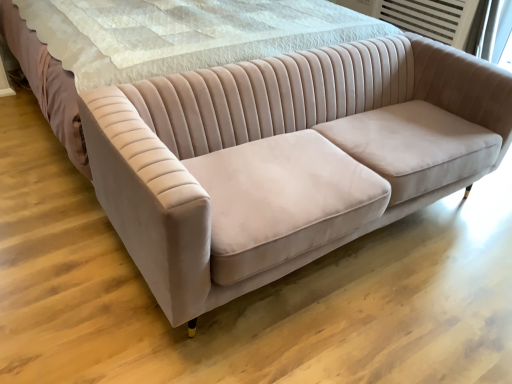
Question: From the image's perspective, is matte pink velvet couch at center above or below velvet beige bed at center?

Choices:
 (A) above
 (B) below

Answer: (B)

Question: Based on their positions, is matte pink velvet couch at center located to the left or right of velvet beige bed at center?

Choices:
 (A) left
 (B) right

Answer: (B)

Question: Is matte pink velvet couch at center in front of or behind velvet beige bed at center in the image?

Choices:
 (A) front
 (B) behind

Answer: (A)

Question: Choose the correct answer: Is velvet beige bed at center inside matte pink velvet couch at center or outside it?

Choices:
 (A) inside
 (B) outside

Answer: (B)

Question: From the image's perspective, is velvet beige bed at center positioned above or below matte pink velvet couch at center?

Choices:
 (A) above
 (B) below

Answer: (A)

Question: In the image, is velvet beige bed at center on the left side or the right side of matte pink velvet couch at center?

Choices:
 (A) right
 (B) left

Answer: (B)

Question: From a real-world perspective, is velvet beige bed at center physically located above or below matte pink velvet couch at center?

Choices:
 (A) below
 (B) above

Answer: (B)